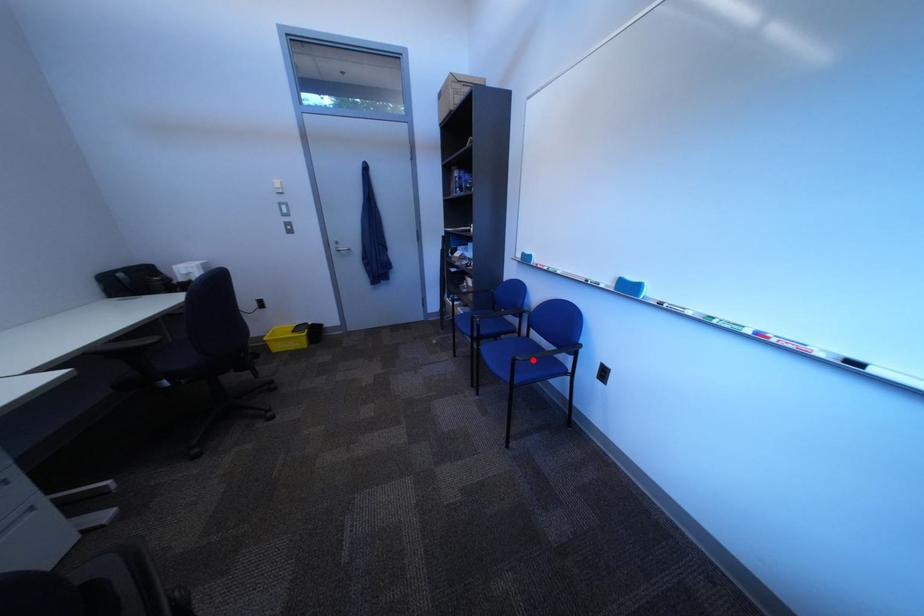
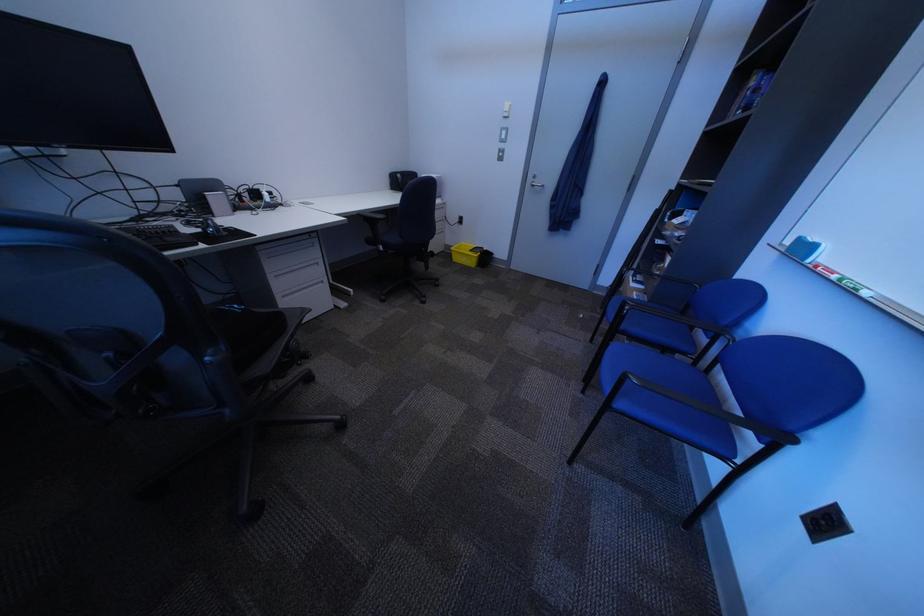
Where in the second image is the point corresponding to the highlighted location from the first image?

(647, 379)